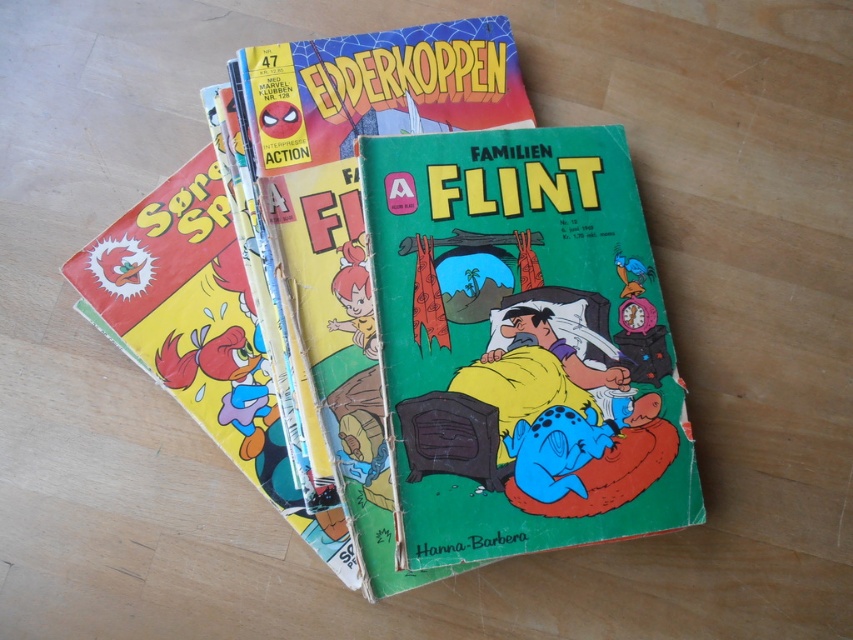
Does point (517, 426) lie in front of point (488, 305)?

Yes, point (517, 426) is in front of point (488, 305).

At what (x,y) coordinates should I click in order to perform the action: click on matte yellow comic book at center. Please return your answer as a coordinate pair (x, y). The height and width of the screenshot is (640, 853). Looking at the image, I should click on pos(467,308).

I want to click on matte yellow comic book at center, so click(467, 308).